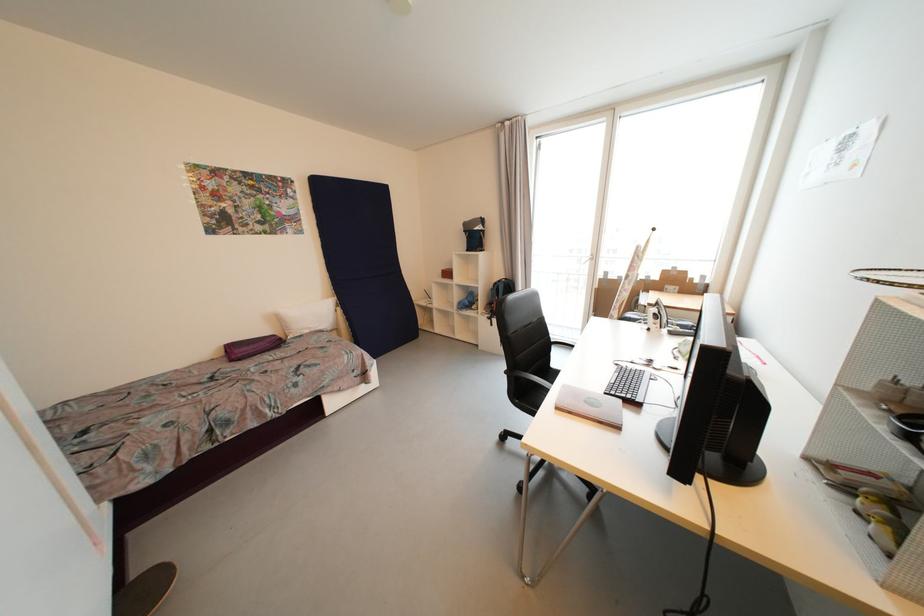
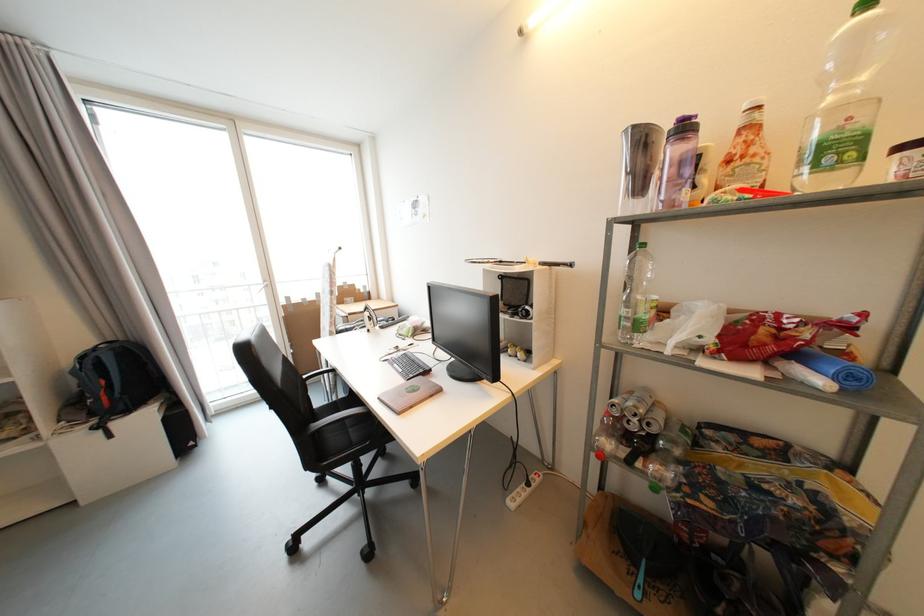
Question: Based on the continuous images, in which direction is the camera rotating? Reply with the corresponding letter.

Choices:
 (A) Left
 (B) Right
 (C) Up
 (D) Down

Answer: (B)